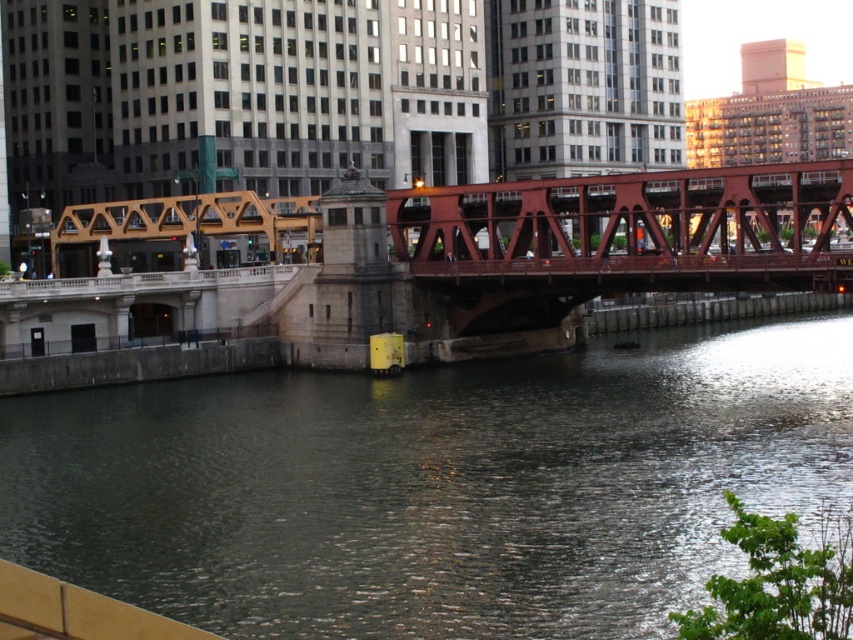
Question: In this image, where is dark green water at center located relative to red steel bridge at center?

Choices:
 (A) above
 (B) below

Answer: (B)

Question: Does dark green water at center appear under red steel bridge at center?

Choices:
 (A) yes
 (B) no

Answer: (A)

Question: Is dark green water at center below red steel bridge at center?

Choices:
 (A) no
 (B) yes

Answer: (B)

Question: Which of the following is the closest to the observer?

Choices:
 (A) red steel bridge at center
 (B) dark green water at center

Answer: (B)